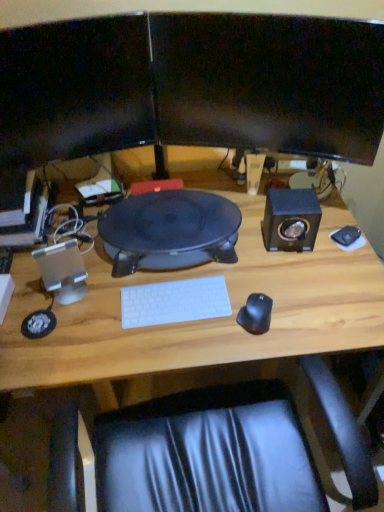
You are a GUI agent. You are given a task and a screenshot of the screen. Output one action in this format:
    pyautogui.click(x=<x>, y=<y>)
    Task: Click on the free location to the right of white plastic keyboard at center
    This screenshot has width=384, height=512.
    Given the screenshot: What is the action you would take?
    pyautogui.click(x=246, y=297)